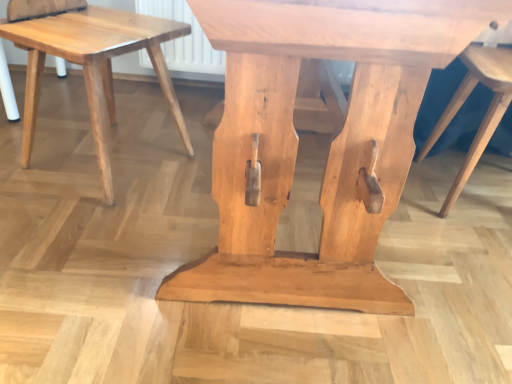
I want to click on vacant space in front of natural wood stool at lower left, the 2th stool positioned from the right, so click(x=81, y=233).